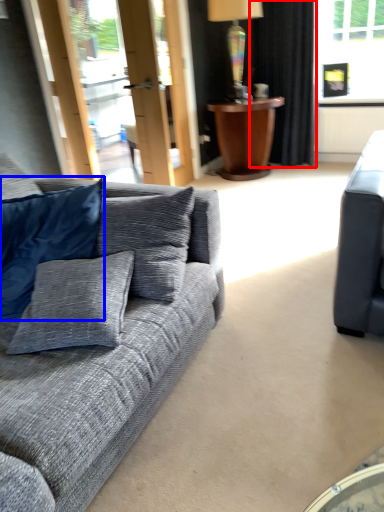
Question: Which of the following is the closest to the observer, curtain (highlighted by a red box) or pillow (highlighted by a blue box)?

Choices:
 (A) curtain
 (B) pillow

Answer: (B)